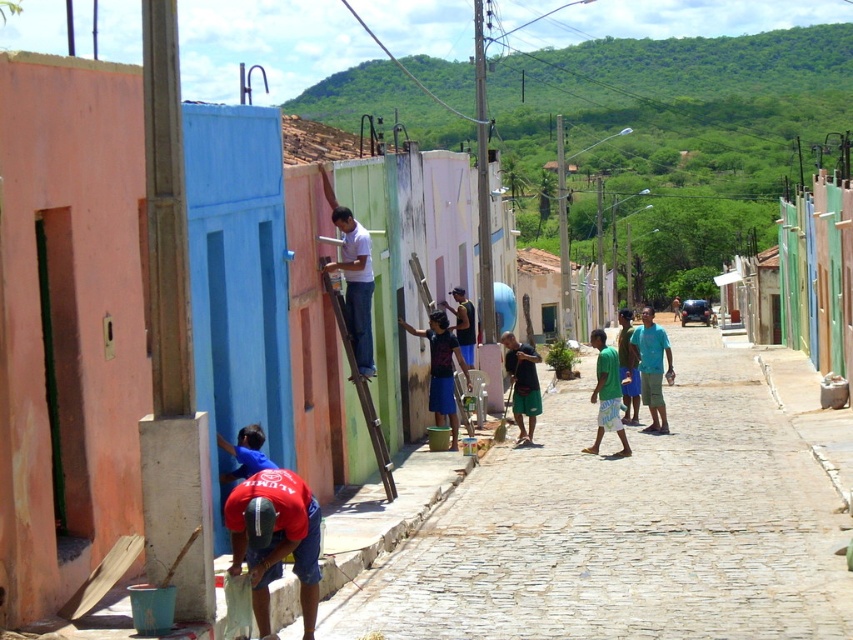
Does blue denim shorts at center have a greater width compared to wooden at center?

Yes, blue denim shorts at center is wider than wooden at center.

Who is taller, blue denim shorts at center or wooden at center?

With more height is wooden at center.

This screenshot has height=640, width=853. What are the coordinates of `blue denim shorts at center` in the screenshot? It's located at (440, 371).

Consider the image. Who is positioned more to the right, light blue fabric shirt at center or matte blue shirt at center?

matte blue shirt at center

The height and width of the screenshot is (640, 853). What do you see at coordinates (352, 278) in the screenshot? I see `light blue fabric shirt at center` at bounding box center [352, 278].

At what (x,y) coordinates should I click in order to perform the action: click on light blue fabric shirt at center. Please return your answer as a coordinate pair (x, y). This screenshot has height=640, width=853. Looking at the image, I should click on (352, 278).

Is light blue fabric shirt at center positioned in front of green cotton shirt at center?

Yes, it is in front of green cotton shirt at center.

Who is higher up, light blue fabric shirt at center or green cotton shirt at center?

Positioned higher is light blue fabric shirt at center.

Image resolution: width=853 pixels, height=640 pixels. I want to click on light blue fabric shirt at center, so click(x=352, y=278).

At what (x,y) coordinates should I click in order to perform the action: click on light blue fabric shirt at center. Please return your answer as a coordinate pair (x, y). Looking at the image, I should click on (352, 278).